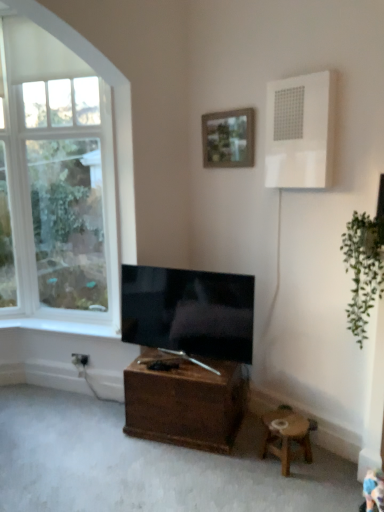
Question: In the image, is white glass window at upper left on the left side or the right side of matte black tv at center?

Choices:
 (A) left
 (B) right

Answer: (A)

Question: Is point (21, 295) positioned closer to the camera than point (125, 286)?

Choices:
 (A) closer
 (B) farther

Answer: (B)

Question: Which is farther from the wooden stool at lower right?

Choices:
 (A) white glass window at upper left
 (B) white smooth window sill at lower left
 (C) brown wooden table at center
 (D) wooden framed picture at upper center
 (E) white plastic air conditioner at upper right

Answer: (A)

Question: Estimate the real-world distances between objects in this image. Which object is closer to the wooden framed picture at upper center?

Choices:
 (A) white glass window at upper left
 (B) matte black tv at center
 (C) brown wooden table at center
 (D) green leafy plant at right
 (E) white smooth window sill at lower left

Answer: (D)